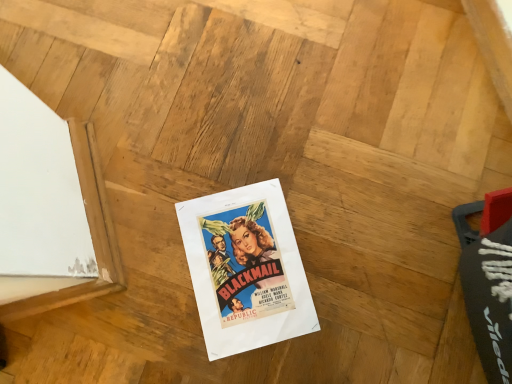
Identify the location of free location to the right of matte paper poster at center. The width and height of the screenshot is (512, 384). (358, 274).